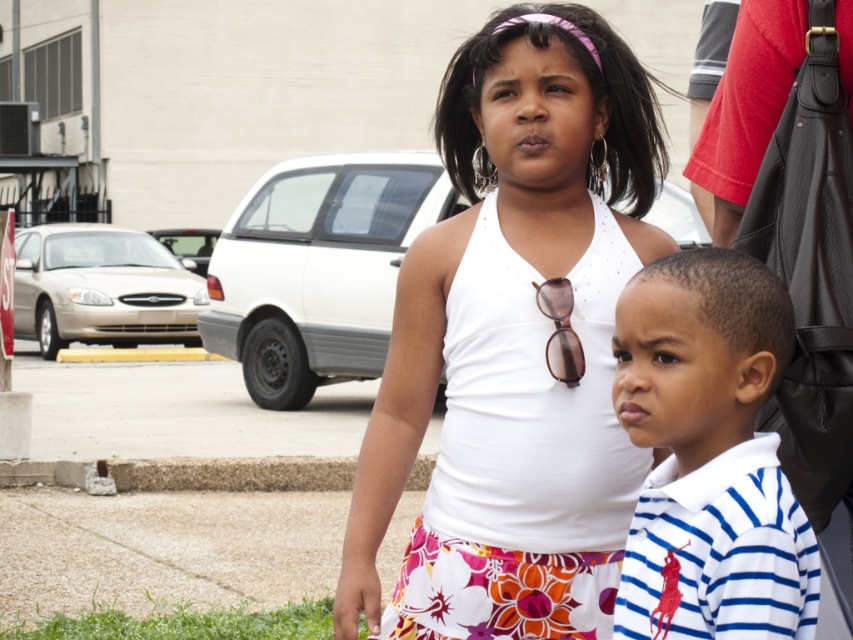
Can you confirm if white striped polo shirt at lower right is smaller than brown matte sunglasses at center?

Incorrect, white striped polo shirt at lower right is not smaller in size than brown matte sunglasses at center.

Between point (711, 435) and point (548, 362), which one is positioned behind?

Positioned behind is point (548, 362).

Locate an element on the screen. The width and height of the screenshot is (853, 640). white striped polo shirt at lower right is located at coordinates (709, 454).

Who is positioned more to the left, white fabric dress at center or white striped polo shirt at lower right?

white fabric dress at center is more to the left.

Between point (469, 337) and point (728, 499), which one is positioned behind?

Positioned behind is point (469, 337).

Where is `white fabric dress at center`? The height and width of the screenshot is (640, 853). white fabric dress at center is located at coordinates (514, 344).

What do you see at coordinates (709, 454) in the screenshot? I see `white striped polo shirt at lower right` at bounding box center [709, 454].

Between white striped polo shirt at lower right and gray concrete curb at lower center, which one has less height?

Standing shorter between the two is gray concrete curb at lower center.

Is point (717, 449) positioned after point (218, 483)?

No, (717, 449) is closer to viewer.

Locate an element on the screen. white striped polo shirt at lower right is located at coordinates (709, 454).